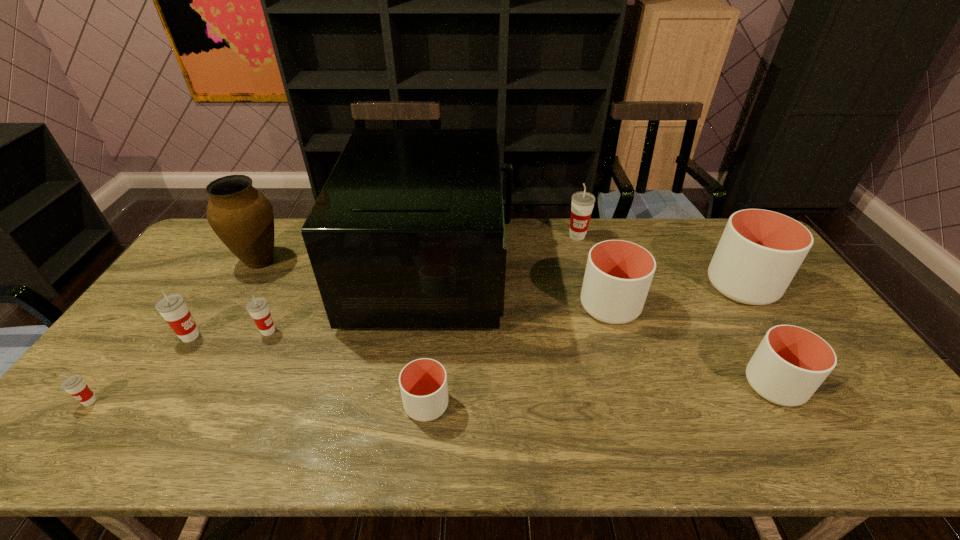
The image size is (960, 540). In order to click on vacant space that satisfies the following two spatial constraints: 1. on the front-facing side of the microwave_oven; 2. on the right side of the third smallest white cup in this screenshot , I will do `click(429, 306)`.

Image resolution: width=960 pixels, height=540 pixels. What are the coordinates of `free space that satisfies the following two spatial constraints: 1. on the side of the fourth object from left to right with the logo; 2. on the right side of the fifth cup from right to left` in the screenshot? It's located at (233, 404).

Identify the location of free space that satisfies the following two spatial constraints: 1. on the side of the third biggest red cup with the logo; 2. on the side of the nearest red cup with the logo. (234, 401).

Where is `vacant area in the image that satisfies the following two spatial constraints: 1. on the front-facing side of the microwave_oven; 2. on the left side of the biggest white cup`? The image size is (960, 540). vacant area in the image that satisfies the following two spatial constraints: 1. on the front-facing side of the microwave_oven; 2. on the left side of the biggest white cup is located at coordinates (431, 286).

I want to click on free spot that satisfies the following two spatial constraints: 1. on the front-facing side of the tallest object; 2. on the right side of the second biggest white cup, so click(x=429, y=306).